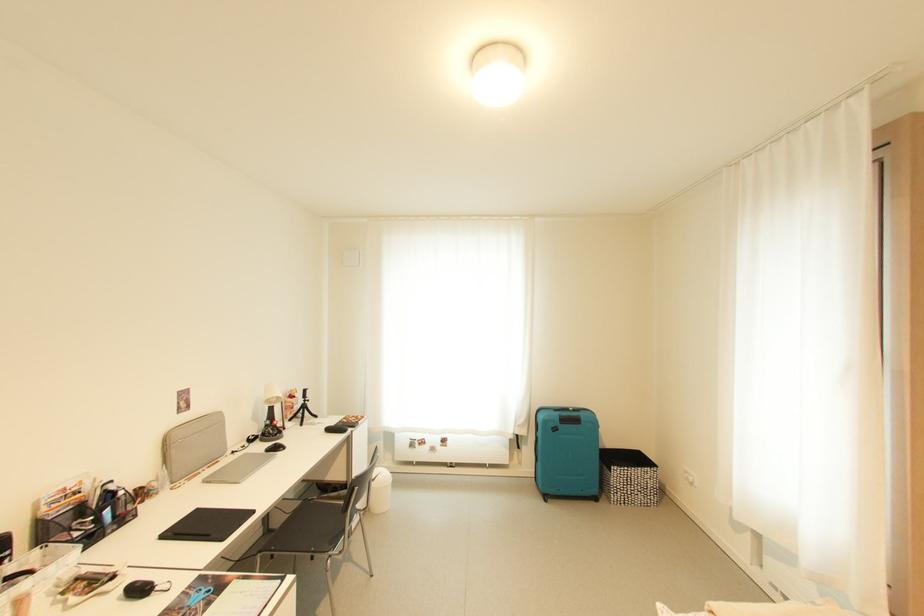
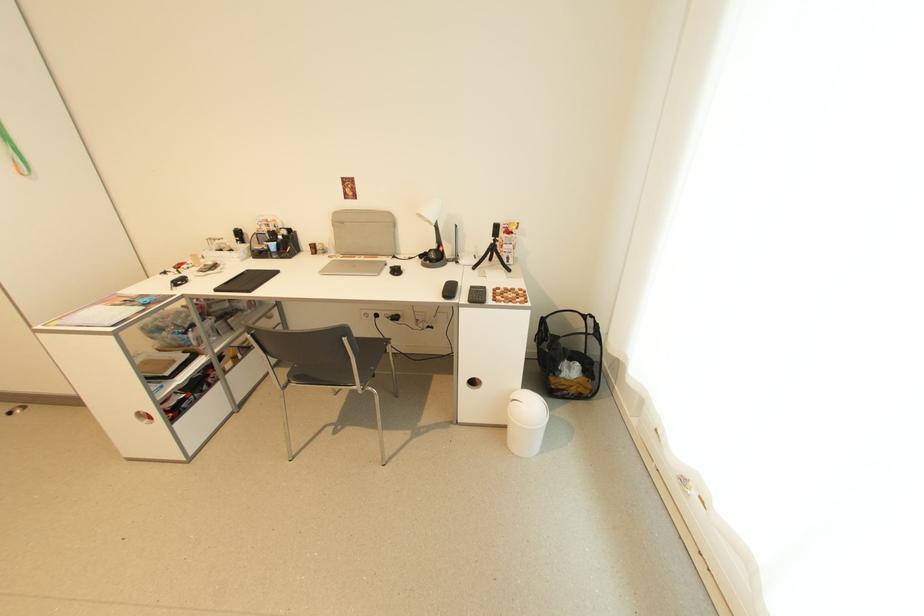
Locate, in the second image, the point that corresponds to the point at 309,400 in the first image.

(497, 238)